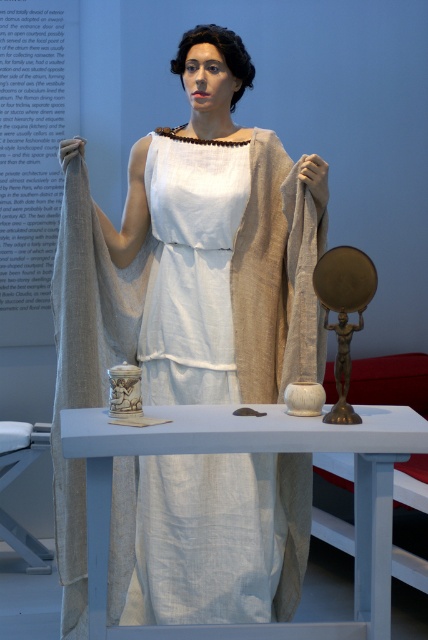
Does point (211, 177) come farther from viewer compared to point (89, 474)?

Yes, it is behind point (89, 474).

Which is in front, point (169, 518) or point (101, 561)?

Point (101, 561) is more forward.

Identify the location of matte white dress at center. The height and width of the screenshot is (640, 428). (184, 273).